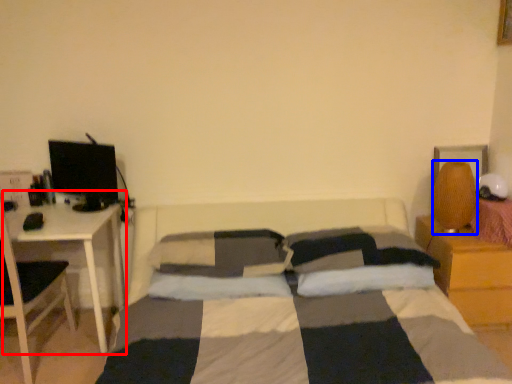
Question: Which point is further to the camera, table (highlighted by a red box) or table lamp (highlighted by a blue box)?

Choices:
 (A) table
 (B) table lamp

Answer: (B)